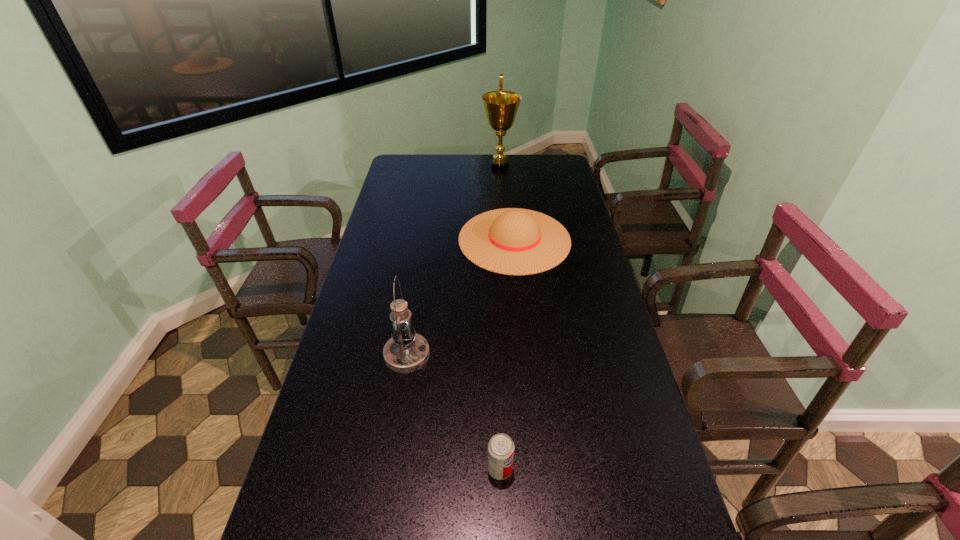
I want to click on free point between the second tallest object and the third nearest object, so click(x=461, y=297).

Image resolution: width=960 pixels, height=540 pixels. I want to click on free point between the bonnet and the tallest object, so click(x=507, y=203).

This screenshot has height=540, width=960. I want to click on free spot between the farthest object and the soda, so click(x=500, y=318).

Find the location of a particular element. unoccupied position between the third nearest object and the third shortest object is located at coordinates (461, 297).

Identify the location of empty space between the nearest object and the second tallest object. This screenshot has height=540, width=960. pyautogui.click(x=453, y=411).

This screenshot has width=960, height=540. In order to click on free spot between the third nearest object and the soda in this screenshot , I will do `click(507, 354)`.

This screenshot has width=960, height=540. In order to click on free space between the tallest object and the third nearest object in this screenshot , I will do `click(507, 203)`.

This screenshot has height=540, width=960. Identify the location of vacant area that lies between the nearest object and the bonnet. (507, 354).

Where is `free space between the oil lamp and the third nearest object`? free space between the oil lamp and the third nearest object is located at coordinates (461, 297).

Locate which object ranks third in proximity to the award. Please provide its 2D coordinates. Your answer should be formatted as a tuple, i.e. [(x, y)], where the tuple contains the x and y coordinates of a point satisfying the conditions above.

[(500, 447)]